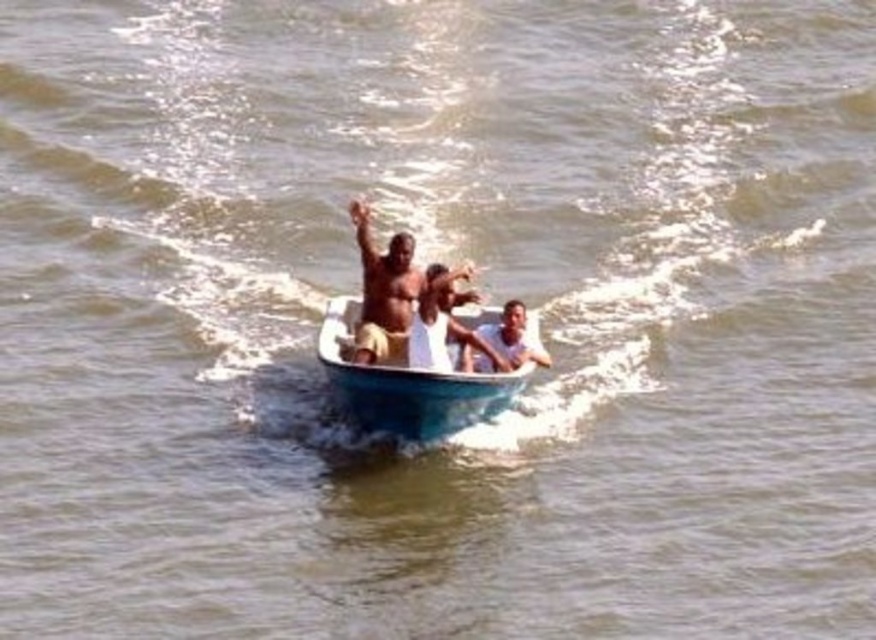
You are standing on a dock and want to throw a lifebuoy to a point that is 56.61 meters away from you. The point is marked as point (366, 390) in the image. Can you reach that point with your throw?

The point (366, 390) is 56.61 meters from the camera, so if your throw can reach that distance, you can throw the lifebuoy to that point.

You are a photographer taking a picture of the light brown skin at center and the smooth skin man at center. Which one is positioned higher in the frame?

The light brown skin at center is positioned higher in the frame than the smooth skin man at center.

You are a photographer trying to capture a clear photo of the smooth skin man at center and the light brown skin at center. Since you are positioned behind the boat, which person should you focus on first to ensure they are in focus?

You should focus on the light brown skin at center first because they are closer to you than the smooth skin man at center, so they will be in focus sooner.